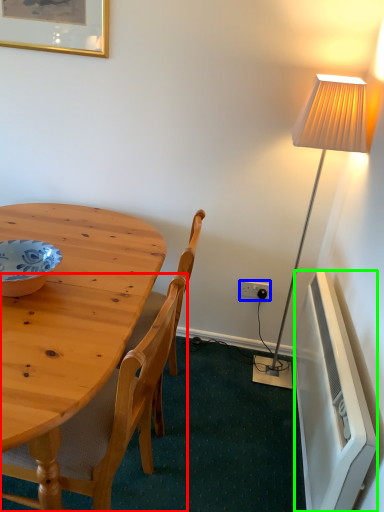
Question: Estimate the real-world distances between objects in this image. Which object is closer to chair (highlighted by a red box), power outlet (highlighted by a blue box) or radiator (highlighted by a green box)?

Choices:
 (A) power outlet
 (B) radiator

Answer: (B)